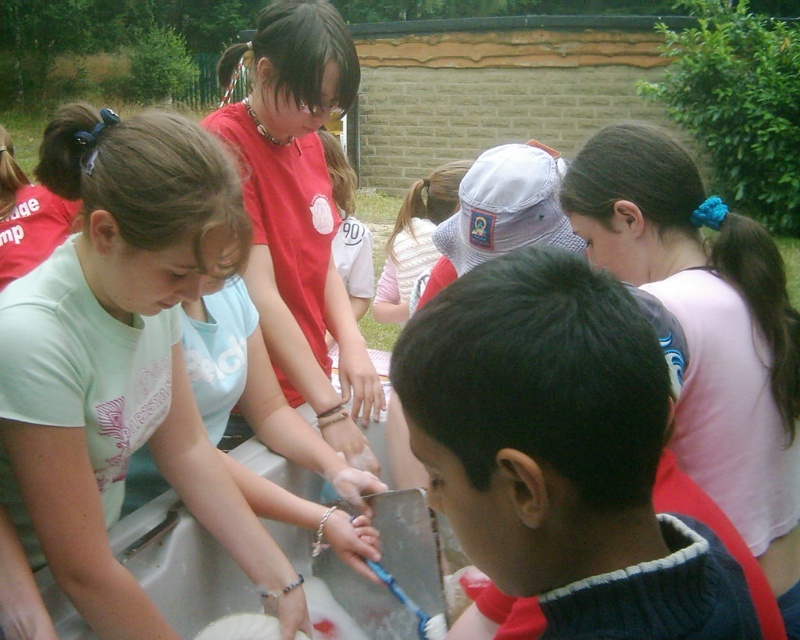
Question: Which object is positioned closest to the white matte hand at center?

Choices:
 (A) smooth plastic spoon at lower center
 (B) matte plastic hand at center
 (C) dark blue sweater at center
 (D) pink fabric ponytail at upper right

Answer: (B)

Question: Can you confirm if smooth plastic spoon at lower center is positioned below smooth skin hand at center?

Choices:
 (A) no
 (B) yes

Answer: (B)

Question: Can you confirm if pink fabric ponytail at upper right is positioned to the left of matte plastic hand at center?

Choices:
 (A) no
 (B) yes

Answer: (A)

Question: Among these objects, which one is nearest to the camera?

Choices:
 (A) matte plastic hand at center
 (B) smooth plastic spoon at lower center
 (C) white matte hand at center
 (D) light green t-shirt at center

Answer: (D)

Question: In this image, where is light green t-shirt at center located relative to smooth skin hand at center?

Choices:
 (A) left
 (B) right

Answer: (A)

Question: Among these objects, which one is nearest to the camera?

Choices:
 (A) white matte hand at center
 (B) dark blue sweater at center
 (C) smooth skin hand at center

Answer: (B)